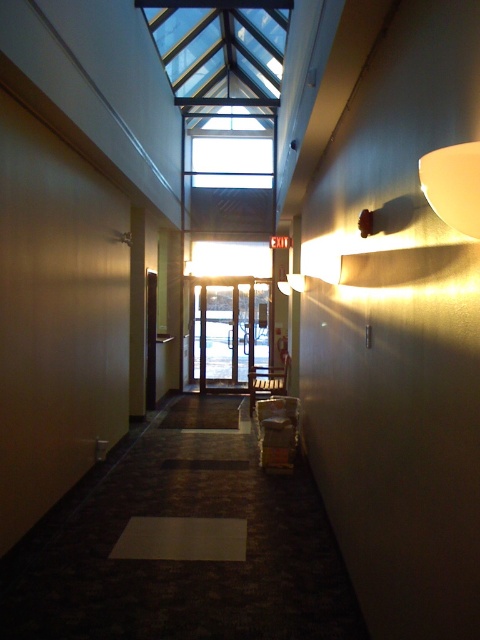
You are moving a large piece of furniture that is 2 meters wide through the corridor. The transparent glass elevator at center is in your path. Can you maneuver around it without hitting the matte white sconce at upper right?

The transparent glass elevator at center is larger than the matte white sconce at upper right, so you should be able to maneuver around the transparent glass elevator at center while keeping a safe distance from the smaller matte white sconce at upper right to avoid collision.

You are moving a large painting that is 1.2 meters wide through the corridor. The painting is too wide to fit through the transparent glass elevator at center. Can you move it past the matte white sconce at upper right?

The transparent glass elevator at center is wider than the matte white sconce at upper right. Since the painting is too wide for the elevator, it is also too wide to pass the matte white sconce at upper right, as the sconce is narrower than the elevator.